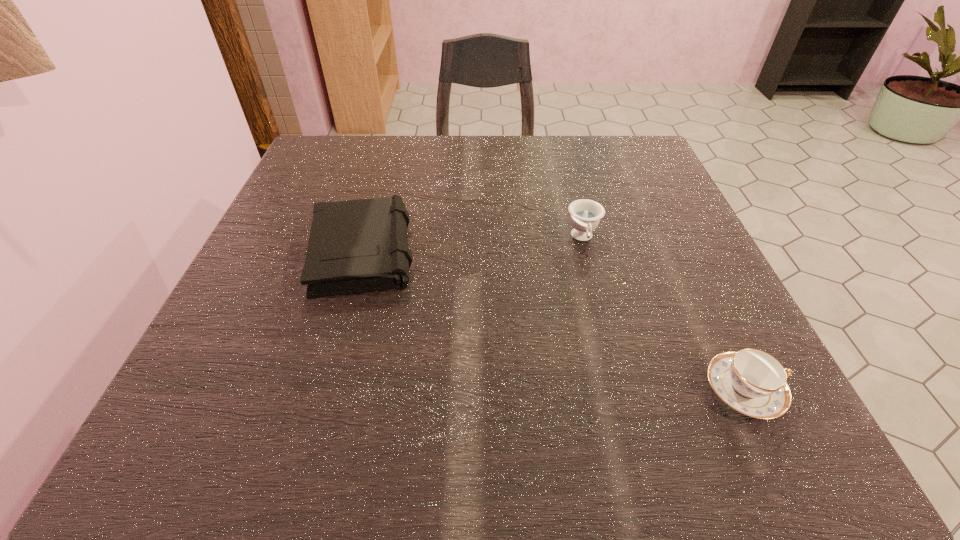
This screenshot has width=960, height=540. Find the location of `vacant space that's between the left teacup and the right teacup`. vacant space that's between the left teacup and the right teacup is located at coordinates (662, 314).

Image resolution: width=960 pixels, height=540 pixels. What are the coordinates of `vacant space that's between the Bible and the left teacup` in the screenshot? It's located at (473, 244).

At what (x,y) coordinates should I click in order to perform the action: click on free spot between the left teacup and the Bible. Please return your answer as a coordinate pair (x, y). The height and width of the screenshot is (540, 960). Looking at the image, I should click on 473,244.

Identify the location of vacant space in between the left teacup and the right teacup. The image size is (960, 540). (662, 314).

The height and width of the screenshot is (540, 960). I want to click on empty location between the nearer teacup and the second object from left to right, so click(662, 314).

Identify the location of vacant area between the nearest object and the left teacup. The height and width of the screenshot is (540, 960). (662, 314).

Image resolution: width=960 pixels, height=540 pixels. I want to click on free spot between the leftmost object and the rightmost object, so click(x=554, y=320).

Where is `unoccupied area between the Bible and the right teacup`? unoccupied area between the Bible and the right teacup is located at coordinates (554, 320).

Where is `free spot between the Bible and the nearest object`? The image size is (960, 540). free spot between the Bible and the nearest object is located at coordinates (554, 320).

I want to click on object that is the second closest to the nearer teacup, so click(x=358, y=246).